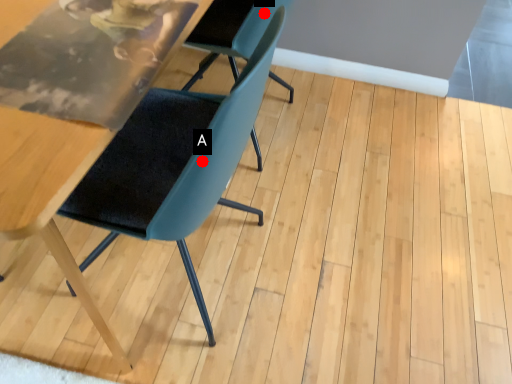
Question: Two points are circled on the image, labeled by A and B beside each circle. Which point is further to the camera?

Choices:
 (A) A is further
 (B) B is further

Answer: (B)